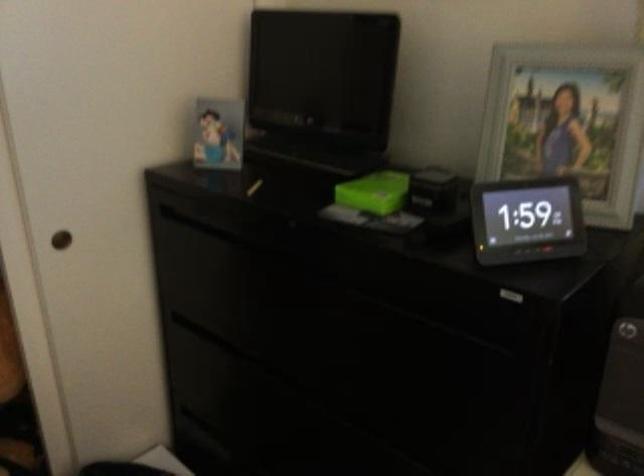
The location [526,220] corresponds to which object?

It corresponds to the digital clock in the image.